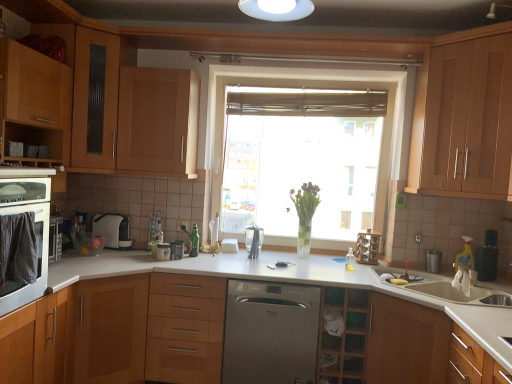
Locate an element on the screen. The image size is (512, 384). vacant space in front of satin silver knife block at center, which appears as the second appliance when viewed from the right is located at coordinates (251, 264).